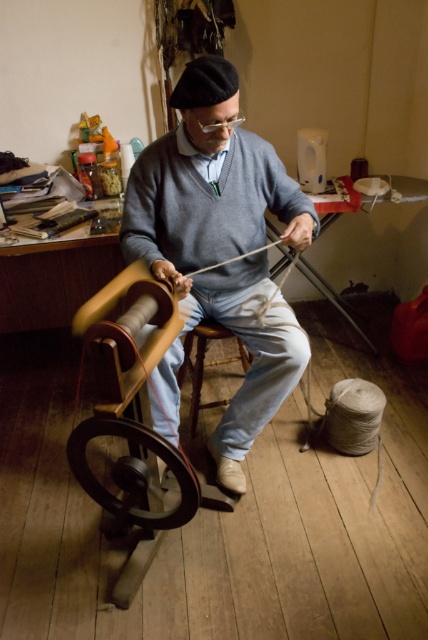
Question: Is gray wool sweater at center bigger than wooden wheel at lower left?

Choices:
 (A) yes
 (B) no

Answer: (A)

Question: From the image, what is the correct spatial relationship of gray wool sweater at center in relation to wooden wheel at lower left?

Choices:
 (A) left
 (B) right

Answer: (B)

Question: Among these points, which one is nearest to the camera?

Choices:
 (A) (270, 369)
 (B) (184, 524)

Answer: (B)

Question: Considering the relative positions of gray wool sweater at center and wooden wheel at lower left in the image provided, where is gray wool sweater at center located with respect to wooden wheel at lower left?

Choices:
 (A) right
 (B) left

Answer: (A)

Question: Which of the following is the farthest from the observer?

Choices:
 (A) (121, 422)
 (B) (169, 376)

Answer: (B)

Question: Which point appears closest to the camera in this image?

Choices:
 (A) (104, 432)
 (B) (267, 196)

Answer: (A)